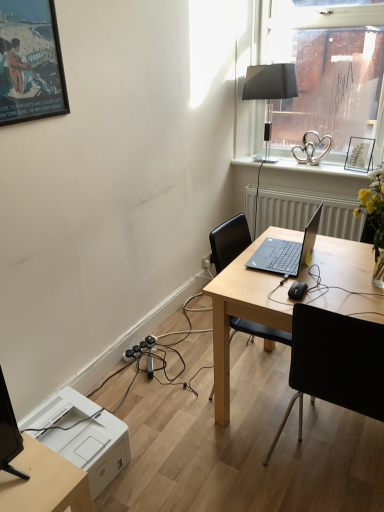
Locate an element on the screen. This screenshot has height=512, width=384. free space in front of sleek black laptop at center is located at coordinates (304, 288).